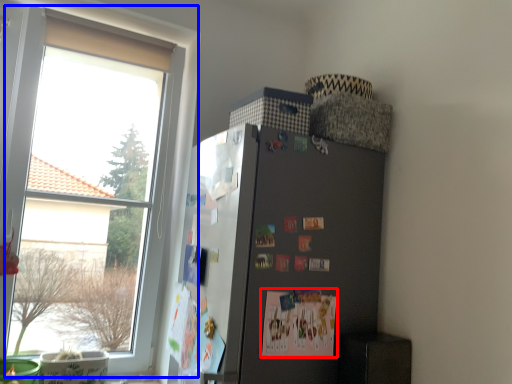
Question: Which object appears closest to the camera in this image, postcard (highlighted by a red box) or window (highlighted by a blue box)?

Choices:
 (A) postcard
 (B) window

Answer: (A)